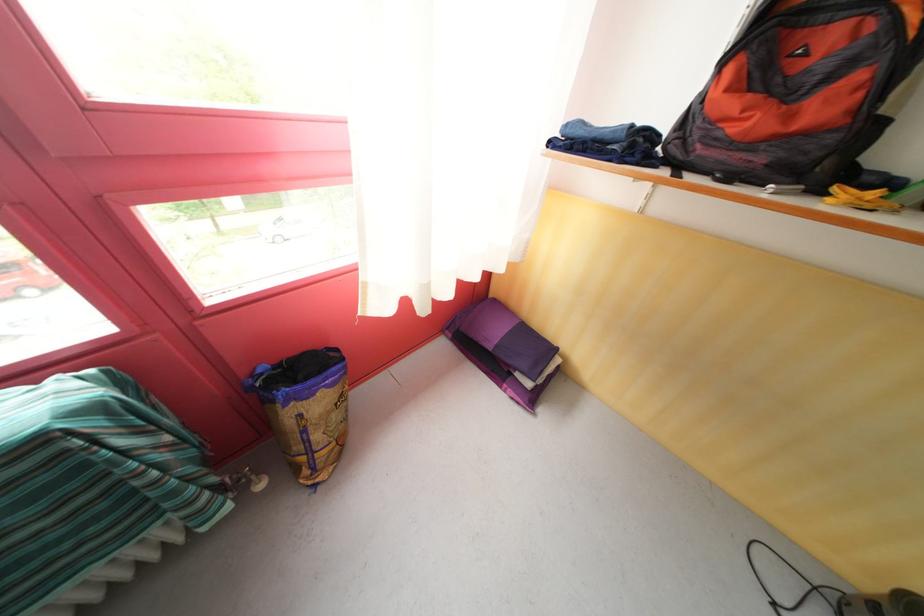
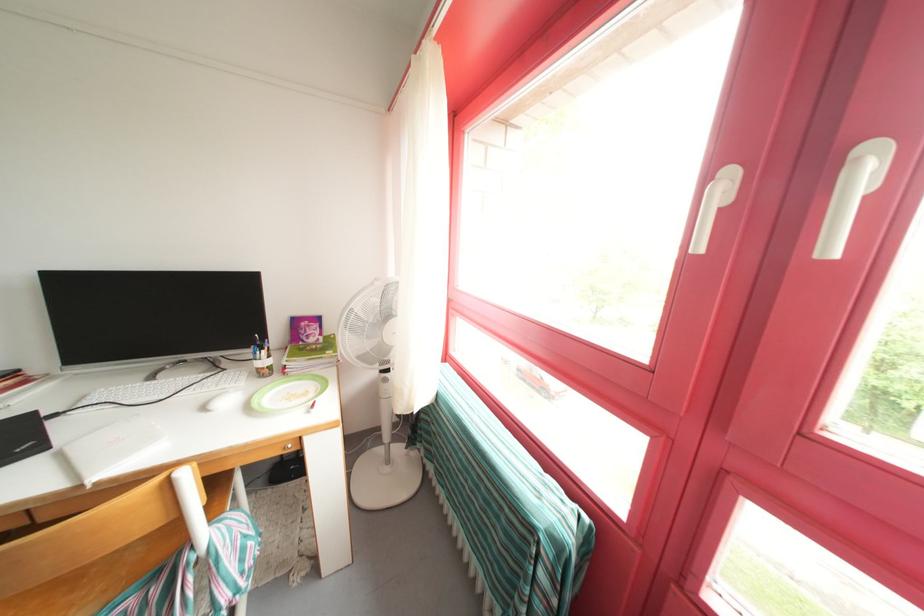
Based on the continuous images, in which direction is the camera rotating?

The camera rotated toward left-down.